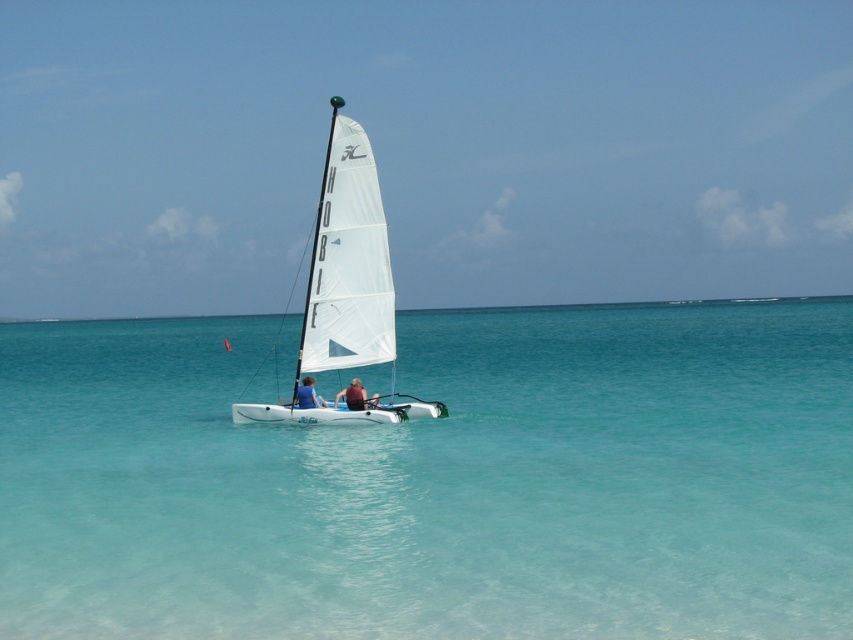
Question: Based on their relative distances, which object is nearer to the matte blue sailboat at center?

Choices:
 (A) blue fabric sailboat at center
 (B) white matte sailboat at center
 (C) clear blue water at center
 (D) reddish-brown leather shirt at center

Answer: (D)

Question: Does reddish-brown leather shirt at center have a lesser width compared to blue fabric sailboat at center?

Choices:
 (A) yes
 (B) no

Answer: (B)

Question: Which object is closer to the camera taking this photo?

Choices:
 (A) blue fabric sailboat at center
 (B) matte blue sailboat at center
 (C) white matte sailboat at center
 (D) reddish-brown leather shirt at center

Answer: (C)

Question: Observing the image, what is the correct spatial positioning of reddish-brown leather shirt at center in reference to blue fabric sailboat at center?

Choices:
 (A) left
 (B) right

Answer: (B)

Question: Among these objects, which one is nearest to the camera?

Choices:
 (A) reddish-brown leather shirt at center
 (B) blue fabric sailboat at center
 (C) white matte sailboat at center

Answer: (C)

Question: Can you confirm if matte blue sailboat at center is positioned to the left of blue fabric sailboat at center?

Choices:
 (A) no
 (B) yes

Answer: (A)